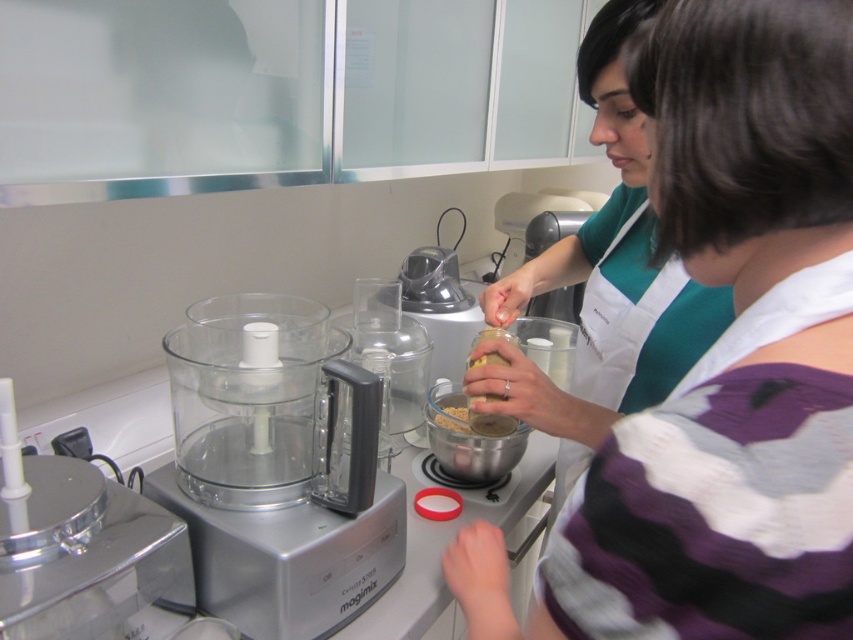
From the picture: You are organizing a kitchen shelf and need to place the brushed metal food processor at left and the transparent plastic blender at center. If the shelf has limited space, which appliance should you place first to ensure both fit?

The brushed metal food processor at left is smaller than the transparent plastic blender at center, so place the smaller food processor first to accommodate the larger blender afterward.

You are a chef preparing a dish and need to choose between wearing the white apron at center or using the brushed metal food processor at left. Which item is larger in size?

The white apron at center is bigger than the brushed metal food processor at left.

You are a chef preparing a recipe that requires mixing ingredients in a specific order. You need to place the transparent plastic blender at center on top of the brushed metal food processor at left to save counter space. Is this possible based on their positions?

The brushed metal food processor at left is located below the transparent plastic blender at center, so placing the blender on top of the food processor would be possible as they are already positioned in a way that allows vertical stacking.